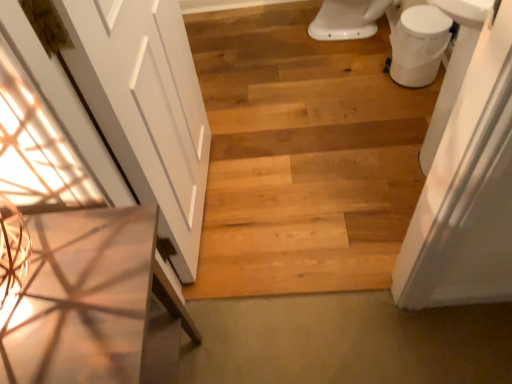
At what (x,y) coordinates should I click in order to perform the action: click on blank space above wooden table at left (from a real-world perspective). Please return your answer as a coordinate pair (x, y). Looking at the image, I should click on (66, 286).